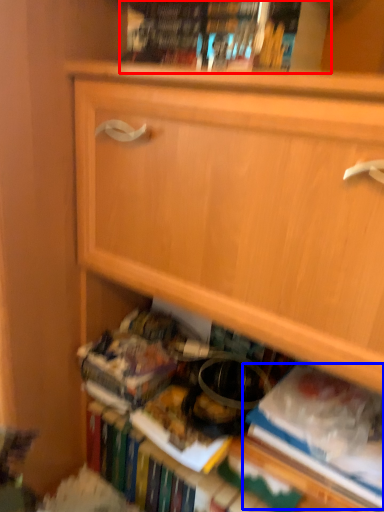
Question: Which object is further to the camera taking this photo, book (highlighted by a red box) or paperback book (highlighted by a blue box)?

Choices:
 (A) book
 (B) paperback book

Answer: (B)